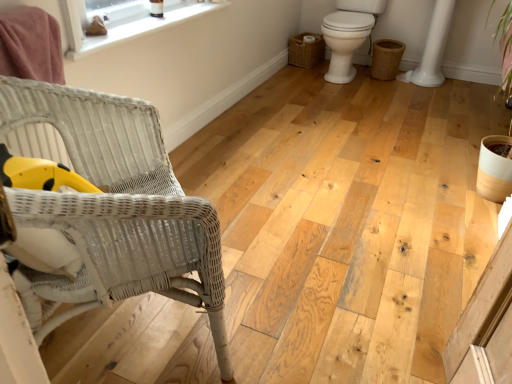
Question: Is braided wicker basket at lower right, positioned as the 1th basket in right-to-left order, not inside woven brown basket at right, the second basket viewed from the right?

Choices:
 (A) no
 (B) yes

Answer: (B)

Question: Considering the relative positions of braided wicker basket at lower right, the second basket when ordered from left to right, and woven brown basket at right, the second basket viewed from the right, in the image provided, is braided wicker basket at lower right, the second basket when ordered from left to right, to the left of woven brown basket at right, the second basket viewed from the right, from the viewer's perspective?

Choices:
 (A) yes
 (B) no

Answer: (B)

Question: Does braided wicker basket at lower right, positioned as the 1th basket in right-to-left order, turn towards woven brown basket at right, the first basket when ordered from left to right?

Choices:
 (A) no
 (B) yes

Answer: (A)

Question: Considering the relative positions of braided wicker basket at lower right, the second basket when ordered from left to right, and woven brown basket at right, the second basket viewed from the right, in the image provided, is braided wicker basket at lower right, the second basket when ordered from left to right, in front of woven brown basket at right, the second basket viewed from the right,?

Choices:
 (A) no
 (B) yes

Answer: (B)

Question: Does braided wicker basket at lower right, positioned as the 1th basket in right-to-left order, have a smaller size compared to woven brown basket at right, the first basket when ordered from left to right?

Choices:
 (A) yes
 (B) no

Answer: (B)

Question: Can you confirm if braided wicker basket at lower right, positioned as the 1th basket in right-to-left order, is bigger than woven brown basket at right, the first basket when ordered from left to right?

Choices:
 (A) yes
 (B) no

Answer: (A)

Question: Considering the relative sizes of woven brown basket at right, the second basket viewed from the right, and white wicker chair at left in the image provided, is woven brown basket at right, the second basket viewed from the right, taller than white wicker chair at left?

Choices:
 (A) no
 (B) yes

Answer: (A)

Question: Is woven brown basket at right, the second basket viewed from the right, not within white wicker chair at left?

Choices:
 (A) no
 (B) yes

Answer: (B)

Question: Is woven brown basket at right, the first basket when ordered from left to right, positioned with its back to white wicker chair at left?

Choices:
 (A) yes
 (B) no

Answer: (B)

Question: From the image's perspective, is woven brown basket at right, the second basket viewed from the right, beneath white wicker chair at left?

Choices:
 (A) yes
 (B) no

Answer: (B)

Question: Is woven brown basket at right, the first basket when ordered from left to right, smaller than white wicker chair at left?

Choices:
 (A) yes
 (B) no

Answer: (A)

Question: Does woven brown basket at right, the first basket when ordered from left to right, turn towards white wicker chair at left?

Choices:
 (A) no
 (B) yes

Answer: (B)

Question: Is white glossy toilet at right located outside white wicker chair at left?

Choices:
 (A) no
 (B) yes

Answer: (B)